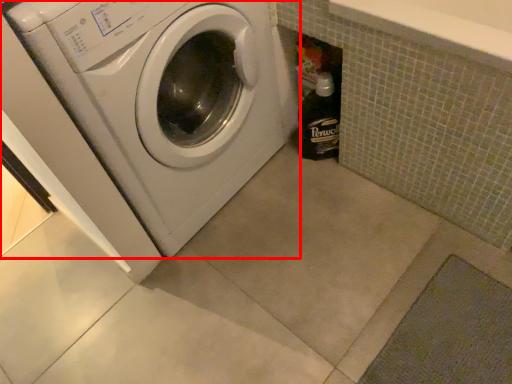
Question: From the image's perspective, where is washing machine (annotated by the red box) located relative to bottle?

Choices:
 (A) below
 (B) above

Answer: (B)